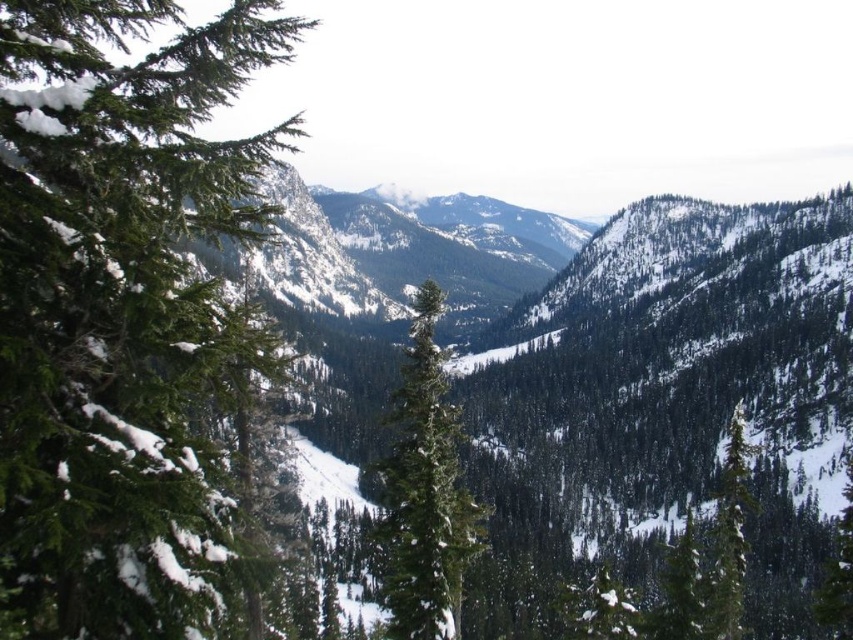
Question: Among these objects, which one is nearest to the camera?

Choices:
 (A) green textured tree at center
 (B) green matte tree at right
 (C) green matte evergreen tree at left

Answer: (C)

Question: Is green matte evergreen tree at left in front of green textured tree at center?

Choices:
 (A) no
 (B) yes

Answer: (B)

Question: Which object is closer to the camera taking this photo?

Choices:
 (A) green textured tree at center
 (B) green matte evergreen tree at left
 (C) green matte tree at right

Answer: (B)

Question: Is the position of green textured tree at center less distant than that of green matte tree at right?

Choices:
 (A) no
 (B) yes

Answer: (B)

Question: Is green matte evergreen tree at left above green textured tree at center?

Choices:
 (A) no
 (B) yes

Answer: (B)

Question: Which point is closer to the camera taking this photo?

Choices:
 (A) (741, 547)
 (B) (431, 419)
 (C) (0, 236)

Answer: (C)